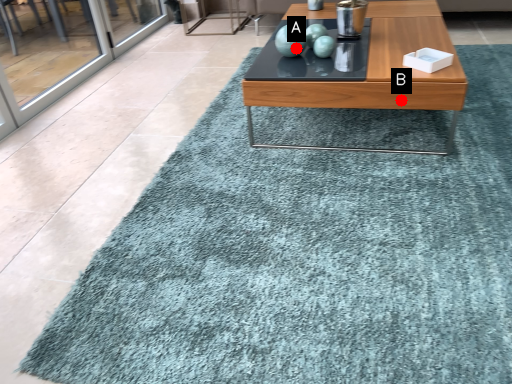
Question: Two points are circled on the image, labeled by A and B beside each circle. Among these points, which one is farthest from the camera?

Choices:
 (A) A is further
 (B) B is further

Answer: (A)